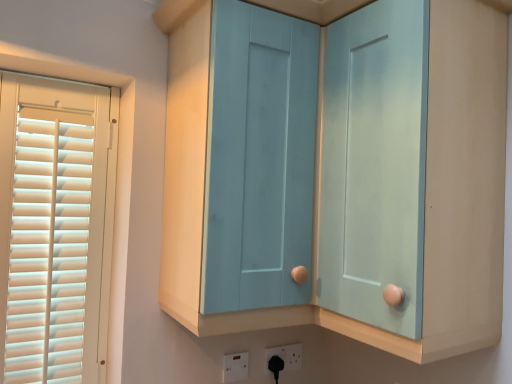
Question: Is matte blue cabinet at center bigger than light blue wood cabinet at center?

Choices:
 (A) no
 (B) yes

Answer: (A)

Question: Considering the relative sizes of matte blue cabinet at center and light blue wood cabinet at center in the image provided, is matte blue cabinet at center shorter than light blue wood cabinet at center?

Choices:
 (A) no
 (B) yes

Answer: (B)

Question: Considering the relative sizes of matte blue cabinet at center and light blue wood cabinet at center in the image provided, is matte blue cabinet at center thinner than light blue wood cabinet at center?

Choices:
 (A) yes
 (B) no

Answer: (A)

Question: Is matte blue cabinet at center directly adjacent to light blue wood cabinet at center?

Choices:
 (A) yes
 (B) no

Answer: (B)

Question: Is matte blue cabinet at center not inside light blue wood cabinet at center?

Choices:
 (A) yes
 (B) no

Answer: (B)

Question: Do you think light blue wood cabinet at center is within white plastic socket at lower center, acting as the first electric outlet starting from the right, or outside of it?

Choices:
 (A) outside
 (B) inside

Answer: (A)

Question: Considering the positions of light blue wood cabinet at center and white plastic socket at lower center, positioned as the 2th electric outlet in front-to-back order, in the image, is light blue wood cabinet at center bigger or smaller than white plastic socket at lower center, positioned as the 2th electric outlet in front-to-back order,?

Choices:
 (A) big
 (B) small

Answer: (A)

Question: From the image's perspective, is light blue wood cabinet at center positioned above or below white plastic socket at lower center, acting as the first electric outlet starting from the right?

Choices:
 (A) above
 (B) below

Answer: (A)

Question: Is point (198, 240) positioned closer to the camera than point (284, 369)?

Choices:
 (A) closer
 (B) farther

Answer: (A)

Question: In terms of width, does white plastic socket at lower center, positioned as the 2th electric outlet in front-to-back order, look wider or thinner when compared to matte blue cabinet at center?

Choices:
 (A) thin
 (B) wide

Answer: (A)

Question: From a real-world perspective, is white plastic socket at lower center, the 2th electric outlet from the left, physically located above or below matte blue cabinet at center?

Choices:
 (A) below
 (B) above

Answer: (A)

Question: In terms of height, does white plastic socket at lower center, positioned as the 2th electric outlet in front-to-back order, look taller or shorter compared to matte blue cabinet at center?

Choices:
 (A) tall
 (B) short

Answer: (B)

Question: Does point (286, 347) appear closer or farther from the camera than point (250, 152)?

Choices:
 (A) closer
 (B) farther

Answer: (B)

Question: From the image's perspective, is white plastic electric outlet at lower center, acting as the first electric outlet starting from the front, located above or below matte blue cabinet at center?

Choices:
 (A) above
 (B) below

Answer: (B)

Question: Is white plastic electric outlet at lower center, arranged as the 2th electric outlet when viewed from the right, wider or thinner than matte blue cabinet at center?

Choices:
 (A) wide
 (B) thin

Answer: (B)